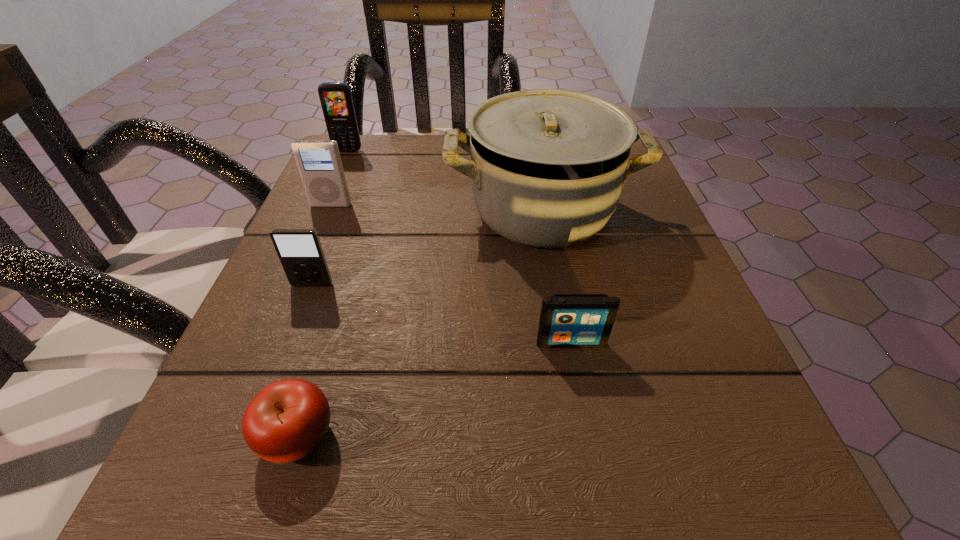
Identify the location of saucepan that is at the right edge. The height and width of the screenshot is (540, 960). (547, 166).

In order to click on iPod that is positioned at the right edge in this screenshot , I will do `click(566, 320)`.

The height and width of the screenshot is (540, 960). In order to click on object located at the far left corner in this screenshot , I will do `click(336, 100)`.

Where is `object located in the near left corner section of the desktop`? object located in the near left corner section of the desktop is located at coordinates (288, 419).

Find the location of `object located at the far right corner`. object located at the far right corner is located at coordinates (547, 166).

In the image, there is a desktop. At what (x,y) coordinates should I click in order to perform the action: click on vacant space at the far edge. Please return your answer as a coordinate pair (x, y). The width and height of the screenshot is (960, 540). Looking at the image, I should click on (432, 149).

I want to click on vacant space at the near edge of the desktop, so click(399, 454).

In the image, there is a desktop. In order to click on vacant space at the left edge in this screenshot , I will do `click(266, 312)`.

In the image, there is a desktop. At what (x,y) coordinates should I click in order to perform the action: click on vacant space at the right edge. Please return your answer as a coordinate pair (x, y). This screenshot has height=540, width=960. Looking at the image, I should click on (664, 349).

In the image, there is a desktop. In order to click on vacant space at the far left corner in this screenshot , I will do `click(363, 151)`.